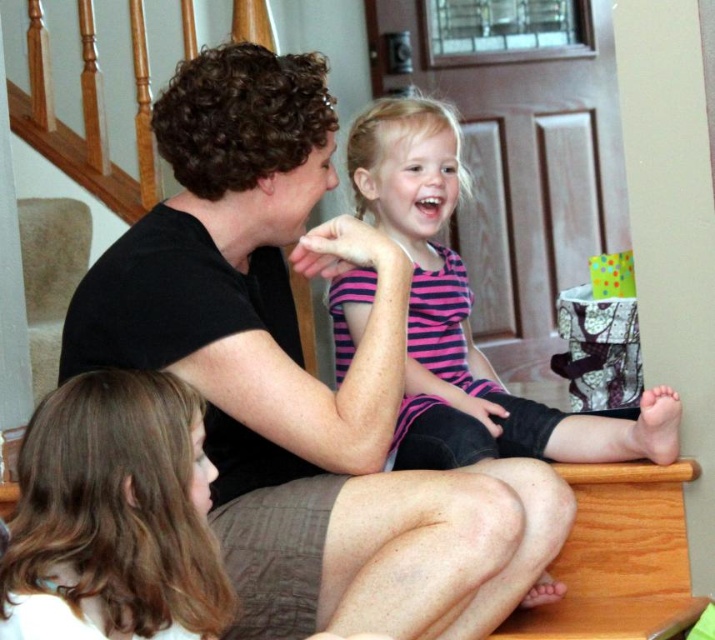
You are a photographer trying to capture a candid shot of the two people sitting on the staircase. Your camera has a minimum focus distance of 30 centimeters. Can you take a photo of both the black matte shirt at center and the pink striped shirt at center without moving the subjects?

The black matte shirt at center and pink striped shirt at center are 31.35 centimeters apart from each other, which is beyond the camera minimum focus distance of 30 centimeters. Therefore, you can take a photo of both the black matte shirt at center and the pink striped shirt at center without moving the subjects.

You are a photographer trying to capture a candid shot of the two subjects in the image. You want to ensure both the black matte shirt at center and the pink striped shirt at center are clearly visible. Based on their positions, which shirt should you focus on first to ensure both are in frame?

The black matte shirt at center is positioned on the left side of the pink striped shirt at center, so focusing on the black matte shirt at center first will allow you to frame both shirts effectively.